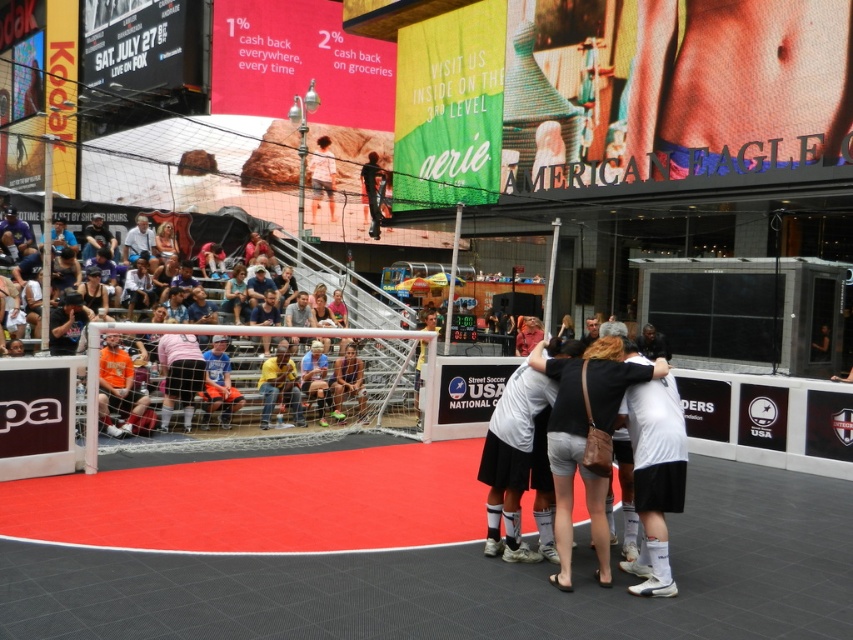
You are organizing a small soccer event and need to place two items in the scene. The orange fabric seats at lower left and the light brown leather jacket at center. Which item has a smaller width?

The orange fabric seats at lower left has a smaller width than the light brown leather jacket at center.

You are standing at the origin point of the image coordinate system. The origin is at the bottom left corner. The x and y axes increase to the right and up respectively. You want to locate the light brown leather jacket at center. What are its coordinates?

The coordinates of the light brown leather jacket at center are at point (322, 176).

You are a photographer trying to capture a candid shot of the light brown leather jacket at center and the dark blue jeans at upper center. Which clothing item would you need to zoom in less on to get both in frame?

The light brown leather jacket at center is thinner than the dark blue jeans at upper center, so you would need to zoom in less on the light brown leather jacket at center to include both in the frame.